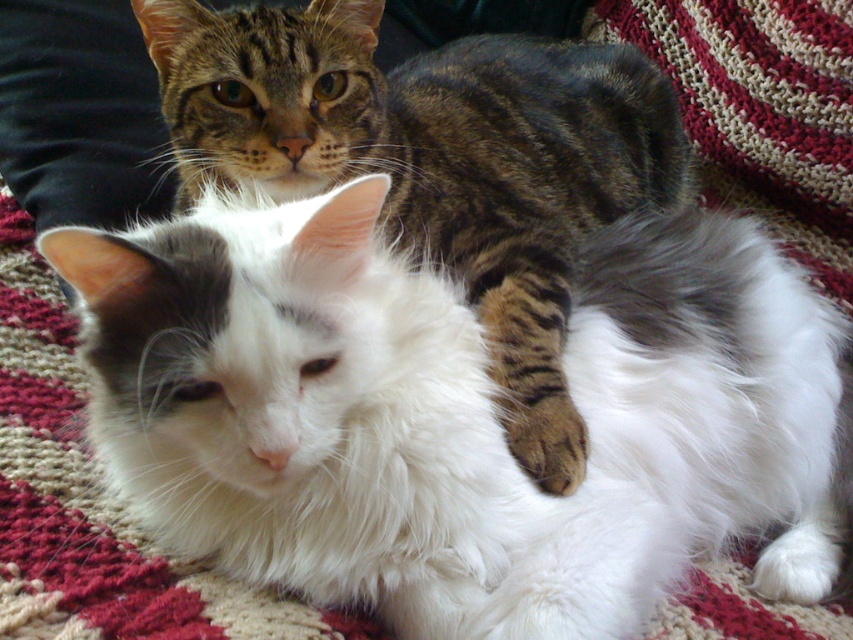
Question: Which object appears closest to the camera in this image?

Choices:
 (A) white fluffy cat at center
 (B) tabby fur cat at upper center

Answer: (B)

Question: Is tabby fur cat at upper center above white fluffy cat at center?

Choices:
 (A) yes
 (B) no

Answer: (B)

Question: Is tabby fur cat at upper center further to the viewer compared to white fluffy cat at center?

Choices:
 (A) no
 (B) yes

Answer: (A)

Question: From the image, what is the correct spatial relationship of tabby fur cat at upper center in relation to white fluffy cat at center?

Choices:
 (A) above
 (B) below

Answer: (B)